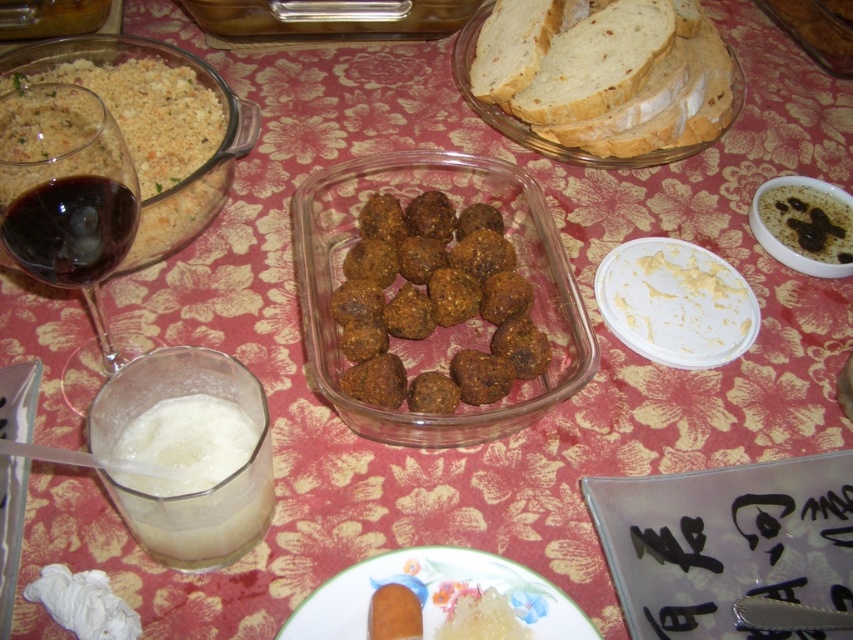
You are at the table and want to reach for the item at point (709, 128). Is it closer to you or farther away compared to the item at point (434, 621)?

The item at point (709, 128) is farther away compared to the item at point (434, 621) because it is behind it.